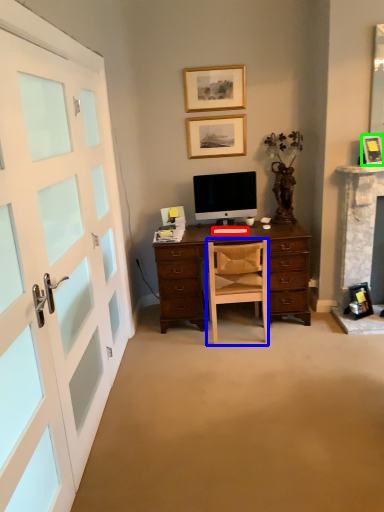
Question: Considering the real-world distances, which object is closest to computer keyboard (highlighted by a red box)? chair (highlighted by a blue box) or picture frame (highlighted by a green box).

Choices:
 (A) chair
 (B) picture frame

Answer: (A)